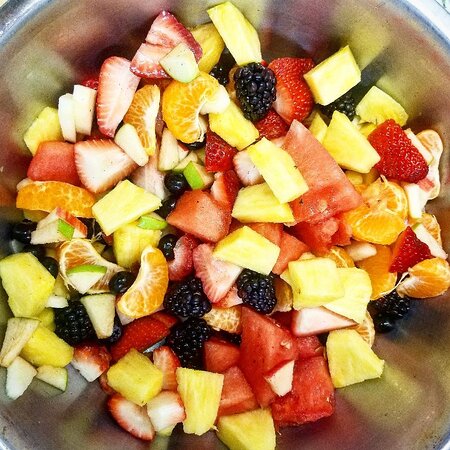
Find the location of `bowl`. bowl is located at coordinates (414, 364).